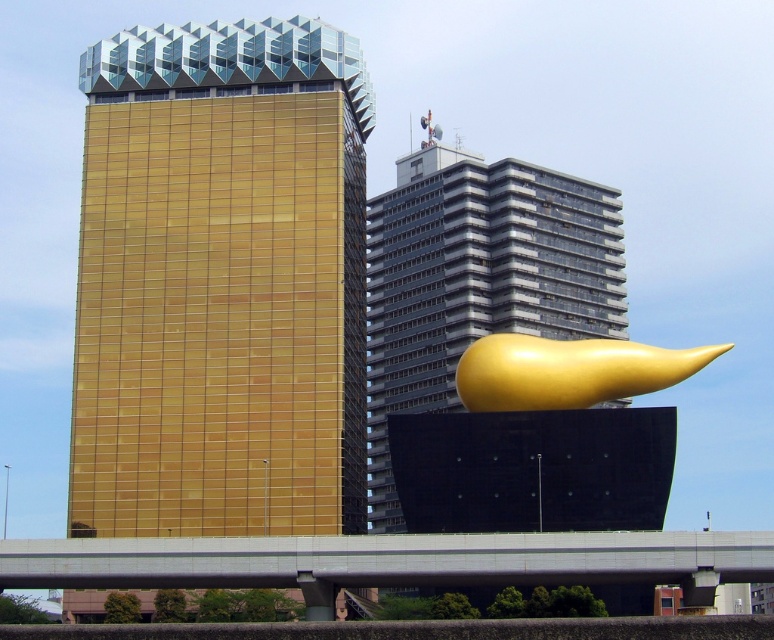
Question: Which of these objects is positioned closest to the shiny metallic sculpture at center?

Choices:
 (A) gold glass tower at center
 (B) gold polished sculpture at center

Answer: (B)

Question: Does gold glass tower at center appear on the left side of gold polished sculpture at center?

Choices:
 (A) yes
 (B) no

Answer: (A)

Question: Which point is farther to the camera?

Choices:
 (A) gold polished sculpture at center
 (B) gold glass tower at center

Answer: (B)

Question: Which of the following is the closest to the observer?

Choices:
 (A) (98, 106)
 (B) (526, 324)
 (C) (603, 388)

Answer: (C)

Question: Is gold glass tower at center below gold polished sculpture at center?

Choices:
 (A) yes
 (B) no

Answer: (B)

Question: Does gold glass tower at center appear under shiny metallic sculpture at center?

Choices:
 (A) no
 (B) yes

Answer: (A)